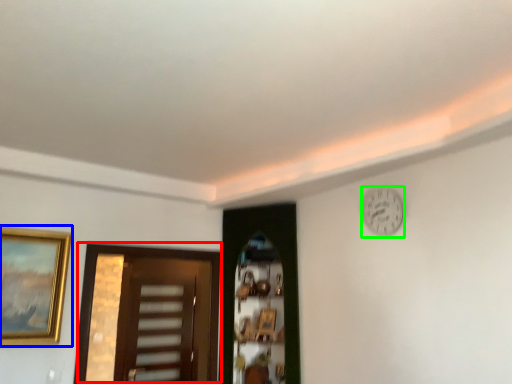
Question: Based on their relative distances, which object is farther from door (highlighted by a red box)? Choose from picture frame (highlighted by a blue box) and clock (highlighted by a green box).

Choices:
 (A) picture frame
 (B) clock

Answer: (B)